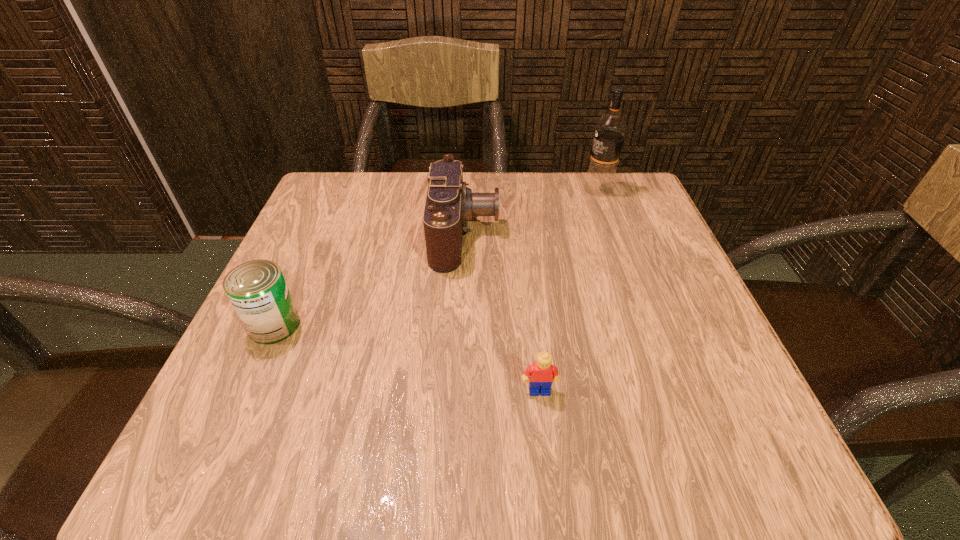
Identify the location of vacant space at the near edge of the desktop. This screenshot has height=540, width=960. (516, 423).

This screenshot has width=960, height=540. In the image, there is a desktop. Identify the location of vacant space at the left edge. (310, 289).

I want to click on blank space at the right edge, so click(x=655, y=271).

At what (x,y) coordinates should I click in order to perform the action: click on free spot at the near left corner of the desktop. Please return your answer as a coordinate pair (x, y). This screenshot has width=960, height=540. Looking at the image, I should click on tap(198, 461).

In order to click on blank space at the near right corner of the desktop in this screenshot , I will do `click(727, 416)`.

Identify the location of free space between the camera and the tallest object. Image resolution: width=960 pixels, height=540 pixels. (532, 212).

Locate an element on the screen. vacant area between the Lego and the second farthest object is located at coordinates (502, 312).

This screenshot has width=960, height=540. Find the location of `empty space that is in between the leftmost object and the Lego`. empty space that is in between the leftmost object and the Lego is located at coordinates (407, 358).

Where is `free point between the can and the third object from left to right`? The height and width of the screenshot is (540, 960). free point between the can and the third object from left to right is located at coordinates (407, 358).

Where is `vacant space in between the can and the third object from right to left`? This screenshot has height=540, width=960. vacant space in between the can and the third object from right to left is located at coordinates (370, 280).